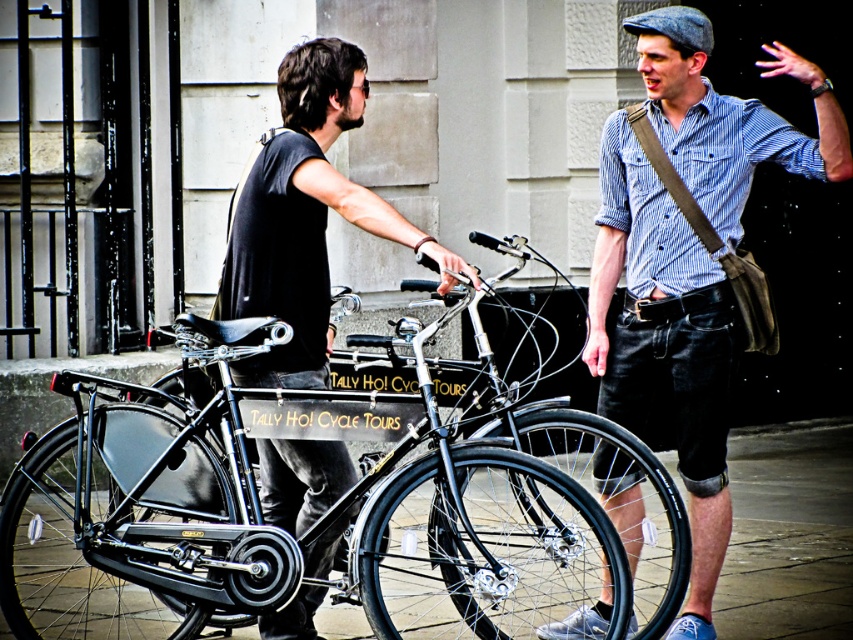
Question: Which is farther from the striped cotton shirt at center?

Choices:
 (A) matte black bicycle at center
 (B) black matte bicycle at center

Answer: (B)

Question: Which object is the farthest from the matte black bicycle at center?

Choices:
 (A) black matte bicycle at center
 (B) black rubber pavement at lower center

Answer: (B)

Question: Is matte black bicycle at center positioned in front of black rubber pavement at lower center?

Choices:
 (A) yes
 (B) no

Answer: (A)

Question: Does black matte bicycle at center have a smaller size compared to black rubber pavement at lower center?

Choices:
 (A) no
 (B) yes

Answer: (A)

Question: Which object is closer to the camera taking this photo?

Choices:
 (A) striped cotton shirt at center
 (B) black rubber pavement at lower center
 (C) black matte bicycle at center
 (D) matte black bicycle at center

Answer: (C)

Question: Is striped cotton shirt at center wider than black rubber pavement at lower center?

Choices:
 (A) yes
 (B) no

Answer: (B)